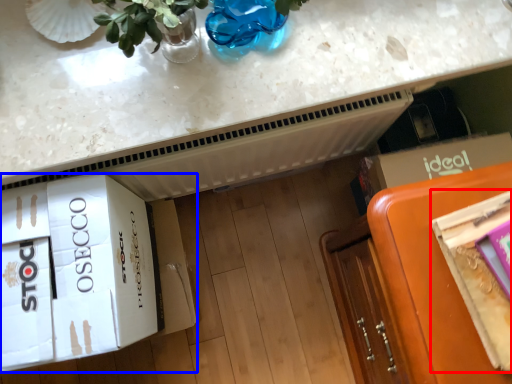
Question: Which object appears closest to the camera in this image, magazine (highlighted by a red box) or cardboard box (highlighted by a blue box)?

Choices:
 (A) magazine
 (B) cardboard box

Answer: (A)